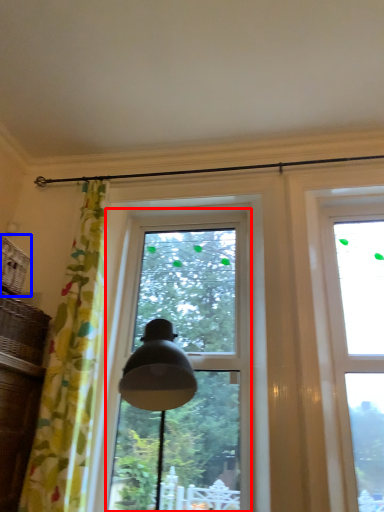
Question: Which of the following is the closest to the observer, window (highlighted by a red box) or basket (highlighted by a blue box)?

Choices:
 (A) window
 (B) basket

Answer: (B)